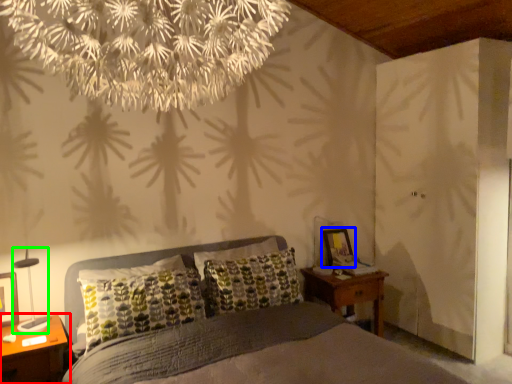
Question: Considering the real-world distances, which object is farthest from nightstand (highlighted by a red box)? picture frame (highlighted by a blue box) or bedside lamp (highlighted by a green box)?

Choices:
 (A) picture frame
 (B) bedside lamp

Answer: (A)